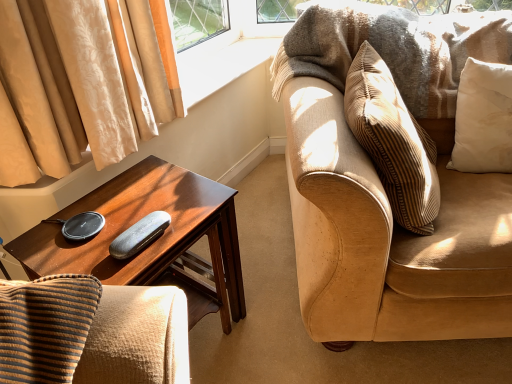
You are a GUI agent. You are given a task and a screenshot of the screen. Output one action in this format:
    pyautogui.click(x=<x>, y=<y>)
    Task: Click on the empty space that is to the right of black textured case at center
    This screenshot has width=512, height=384.
    Given the screenshot: What is the action you would take?
    pyautogui.click(x=190, y=221)